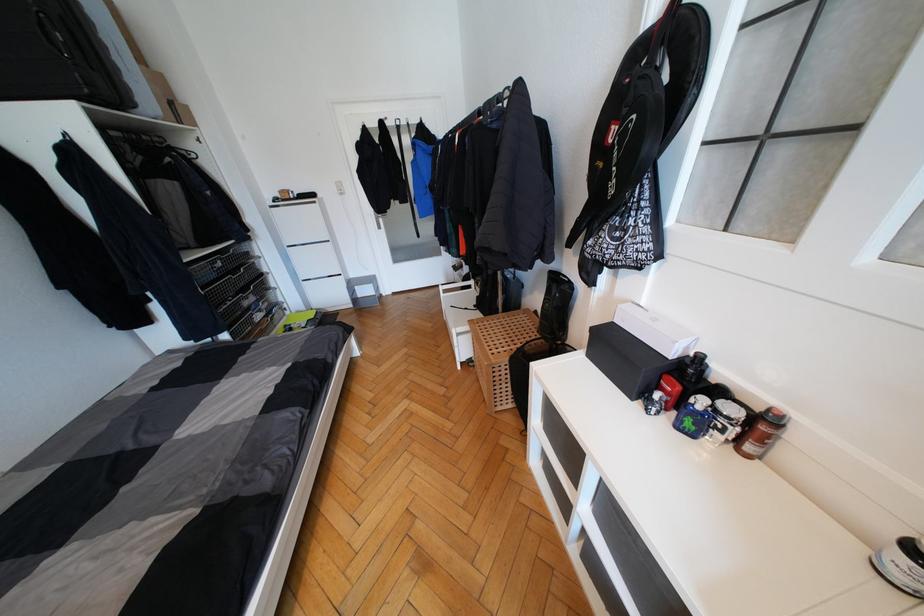
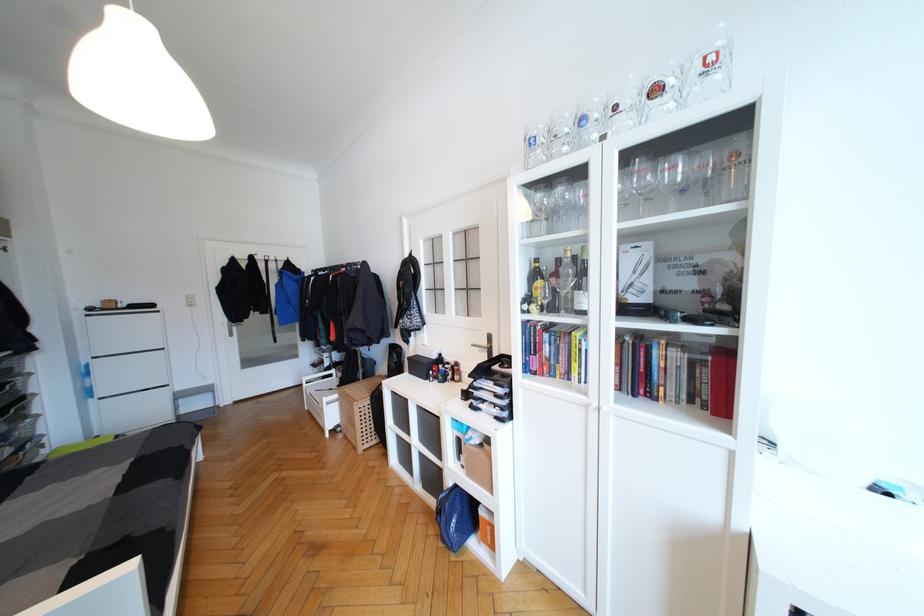
Where in the second image is the point corresponding to point 472,338 from the first image?

(339, 405)